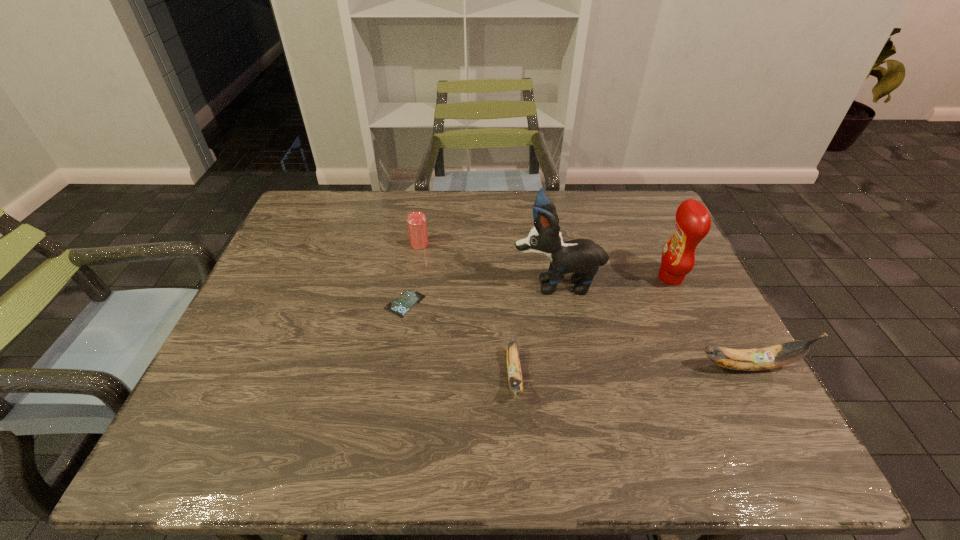
Identify the location of vacant place for an extra banana on the left. (273, 386).